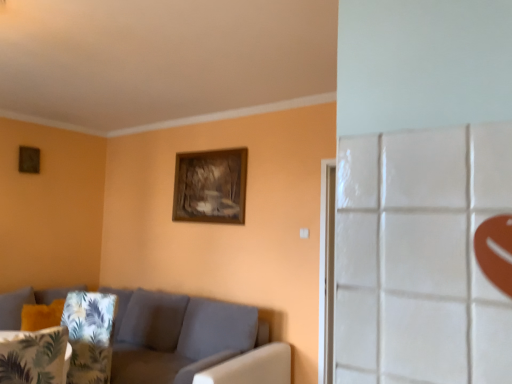
Question: Can you confirm if wooden frame at upper center is taller than fabric couch at lower left?

Choices:
 (A) no
 (B) yes

Answer: (A)

Question: From the image's perspective, would you say wooden frame at upper center is shown under fabric couch at lower left?

Choices:
 (A) yes
 (B) no

Answer: (B)

Question: From a real-world perspective, is wooden frame at upper center over fabric couch at lower left?

Choices:
 (A) yes
 (B) no

Answer: (A)

Question: Can you confirm if wooden frame at upper center is smaller than fabric couch at lower left?

Choices:
 (A) no
 (B) yes

Answer: (B)

Question: Considering the relative sizes of wooden frame at upper center and fabric couch at lower left in the image provided, is wooden frame at upper center wider than fabric couch at lower left?

Choices:
 (A) yes
 (B) no

Answer: (B)

Question: Does wooden frame at upper center have a larger size compared to fabric couch at lower left?

Choices:
 (A) yes
 (B) no

Answer: (B)

Question: From the image's perspective, is green leafy fabric pillow at lower left located above wooden frame at upper center?

Choices:
 (A) no
 (B) yes

Answer: (A)

Question: Can you confirm if green leafy fabric pillow at lower left is taller than wooden frame at upper center?

Choices:
 (A) no
 (B) yes

Answer: (A)

Question: Considering the relative sizes of green leafy fabric pillow at lower left and wooden frame at upper center in the image provided, is green leafy fabric pillow at lower left wider than wooden frame at upper center?

Choices:
 (A) yes
 (B) no

Answer: (A)

Question: Is the position of green leafy fabric pillow at lower left less distant than that of wooden frame at upper center?

Choices:
 (A) yes
 (B) no

Answer: (A)

Question: Is green leafy fabric pillow at lower left to the left of wooden frame at upper center from the viewer's perspective?

Choices:
 (A) yes
 (B) no

Answer: (A)

Question: Can we say green leafy fabric pillow at lower left lies outside wooden frame at upper center?

Choices:
 (A) no
 (B) yes

Answer: (B)

Question: Is wooden frame at upper center positioned with its back to green leafy fabric pillow at lower left?

Choices:
 (A) no
 (B) yes

Answer: (A)